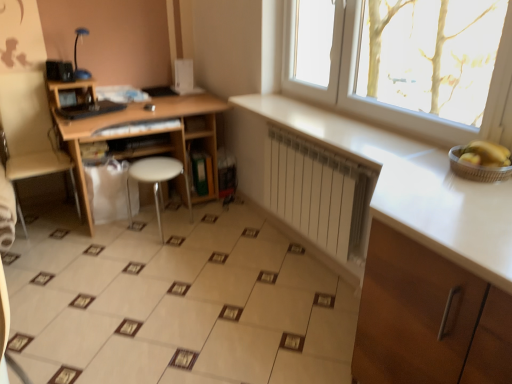
Find the location of a particular element. vacant area that is in front of wooden desk at left is located at coordinates (136, 279).